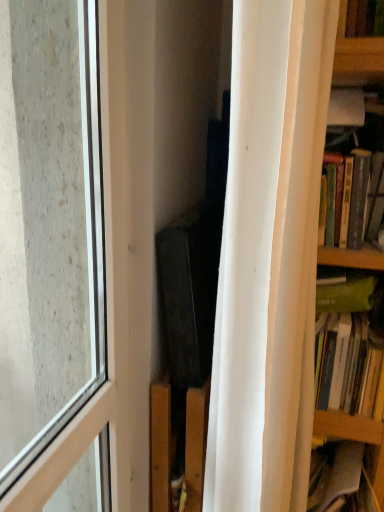
Question: From the image's perspective, is white matte curtain at right positioned above or below hardcover books at right, acting as the first book starting from the top?

Choices:
 (A) below
 (B) above

Answer: (A)

Question: Based on their positions, is white matte curtain at right located to the left or right of hardcover books at right, the 2th book ordered from the bottom?

Choices:
 (A) right
 (B) left

Answer: (B)

Question: Estimate the real-world distances between objects in this image. Which object is closer to the transparent glass window at left?

Choices:
 (A) green matte book at right, arranged as the second book when viewed from the top
 (B) white matte curtain at right
 (C) hardcover books at right, the 2th book ordered from the bottom

Answer: (B)

Question: Which object is positioned farthest from the transparent glass window at left?

Choices:
 (A) hardcover books at right, acting as the first book starting from the top
 (B) white matte curtain at right
 (C) green matte book at right, arranged as the second book when viewed from the top

Answer: (A)